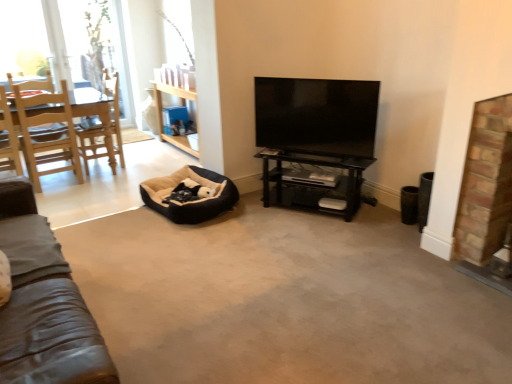
Question: Is wooden chair at left, the 1th chair positioned from the right, touching black glossy shelf at center?

Choices:
 (A) no
 (B) yes

Answer: (A)

Question: Is wooden chair at left, the second chair positioned from the left, bigger than black glossy shelf at center?

Choices:
 (A) yes
 (B) no

Answer: (A)

Question: Is wooden chair at left, the second chair positioned from the left, smaller than black glossy shelf at center?

Choices:
 (A) no
 (B) yes

Answer: (A)

Question: From a real-world perspective, is wooden chair at left, the second chair positioned from the left, located higher than black glossy shelf at center?

Choices:
 (A) no
 (B) yes

Answer: (B)

Question: Is wooden chair at left, the second chair positioned from the left, further to the viewer compared to black glossy shelf at center?

Choices:
 (A) no
 (B) yes

Answer: (B)

Question: In terms of height, does black glossy shelf at center look taller or shorter compared to brick fireplace at right?

Choices:
 (A) tall
 (B) short

Answer: (B)

Question: Is point (320, 192) positioned closer to the camera than point (495, 228)?

Choices:
 (A) closer
 (B) farther

Answer: (B)

Question: From a real-world perspective, relative to brick fireplace at right, is black glossy shelf at center vertically above or below?

Choices:
 (A) above
 (B) below

Answer: (B)

Question: In terms of width, does black glossy shelf at center look wider or thinner when compared to brick fireplace at right?

Choices:
 (A) thin
 (B) wide

Answer: (B)

Question: Considering the positions of black glossy shelf at center and wooden chair at left, the 1th chair positioned from the right, in the image, is black glossy shelf at center taller or shorter than wooden chair at left, the 1th chair positioned from the right,?

Choices:
 (A) tall
 (B) short

Answer: (B)

Question: Looking at the image, does black glossy shelf at center seem bigger or smaller compared to wooden chair at left, the 1th chair positioned from the right?

Choices:
 (A) big
 (B) small

Answer: (B)

Question: From a real-world perspective, is black glossy shelf at center physically located above or below wooden chair at left, the second chair positioned from the left?

Choices:
 (A) above
 (B) below

Answer: (B)

Question: Choose the correct answer: Is black glossy shelf at center inside wooden chair at left, the 1th chair positioned from the right, or outside it?

Choices:
 (A) outside
 (B) inside

Answer: (A)

Question: In terms of width, does wooden chair at left, the 1th chair positioned from the right, look wider or thinner when compared to light wood chair at left, the 2th chair when ordered from right to left?

Choices:
 (A) wide
 (B) thin

Answer: (A)

Question: From a real-world perspective, relative to light wood chair at left, the 2th chair when ordered from right to left, is wooden chair at left, the second chair positioned from the left, vertically above or below?

Choices:
 (A) above
 (B) below

Answer: (B)